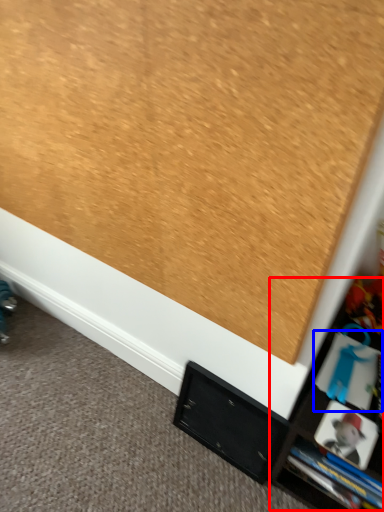
Question: Among these objects, which one is farthest to the camera, tv cabinet (highlighted by a red box) or book (highlighted by a blue box)?

Choices:
 (A) tv cabinet
 (B) book

Answer: (B)